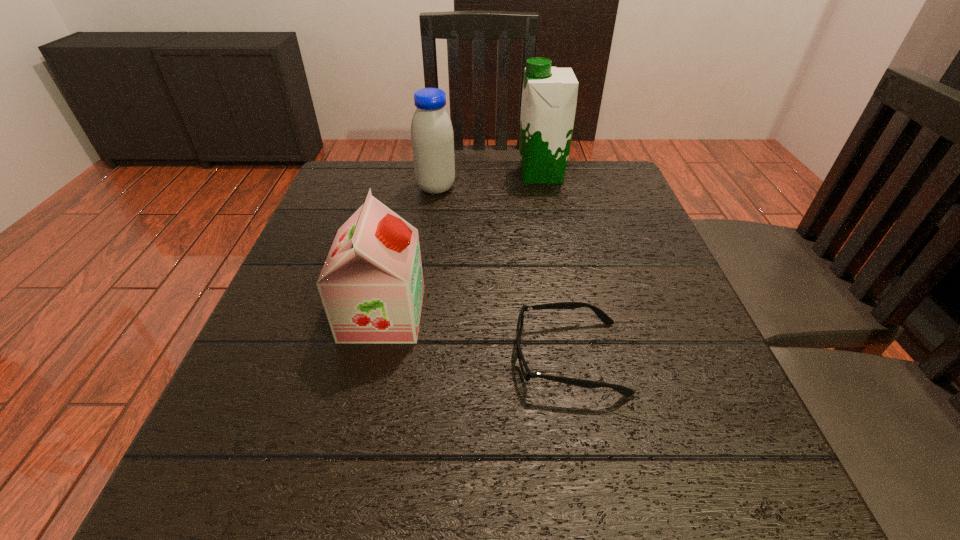
Locate an element on the screen. The width and height of the screenshot is (960, 540). the closest soya milk relative to the spectacles is located at coordinates (371, 285).